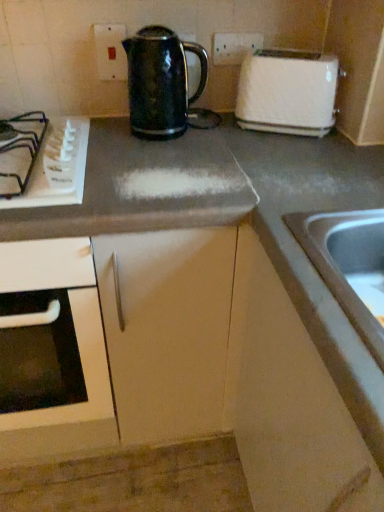
Image resolution: width=384 pixels, height=512 pixels. Identify the location of free space in front of shiny black kettle at center. (163, 156).